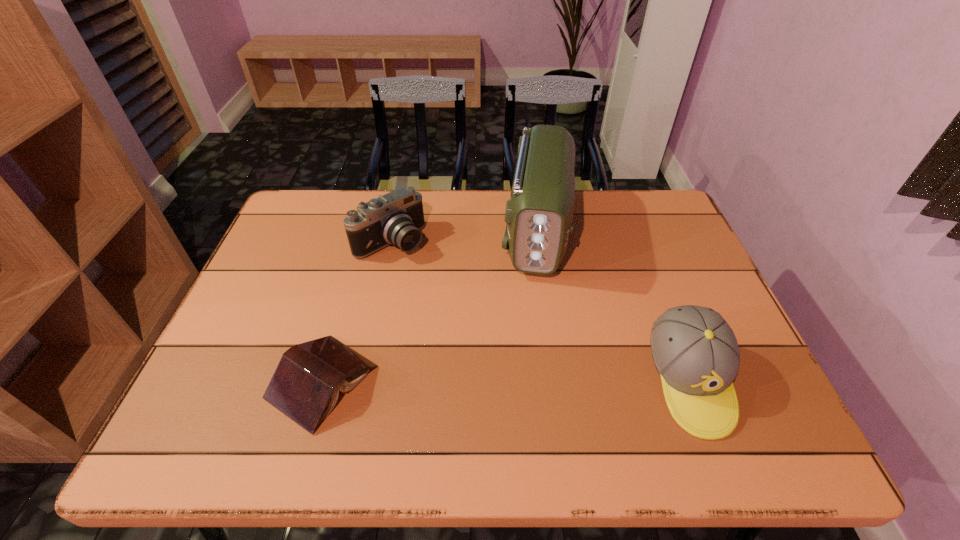
The image size is (960, 540). Find the location of `vacant space on the desktop that is between the book and the baseball cap and is positioned on the front-facing side of the camera`. vacant space on the desktop that is between the book and the baseball cap and is positioned on the front-facing side of the camera is located at coordinates (547, 381).

This screenshot has height=540, width=960. I want to click on vacant space on the desktop that is between the book and the rightmost object and is positioned on the front-facing side of the second object from right to left, so click(x=519, y=381).